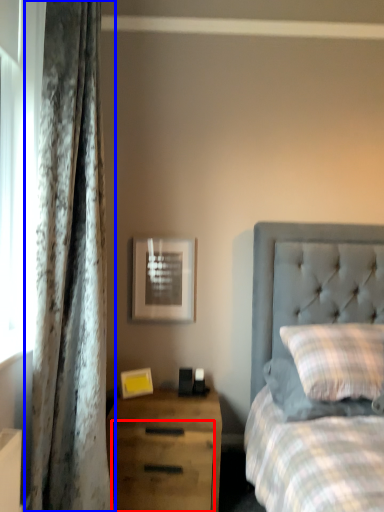
Question: Among these objects, which one is nearest to the camera, drawer (highlighted by a red box) or curtain (highlighted by a blue box)?

Choices:
 (A) drawer
 (B) curtain

Answer: (B)